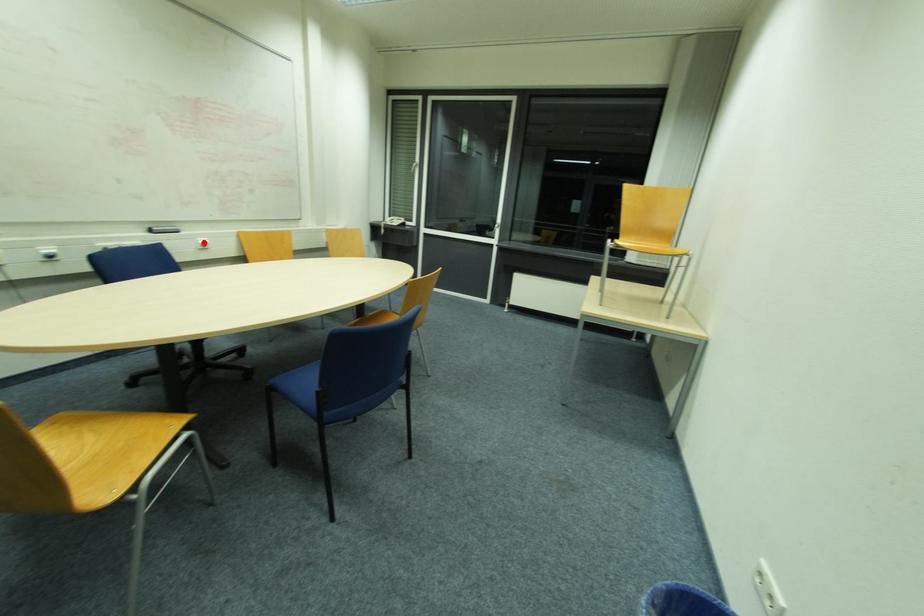
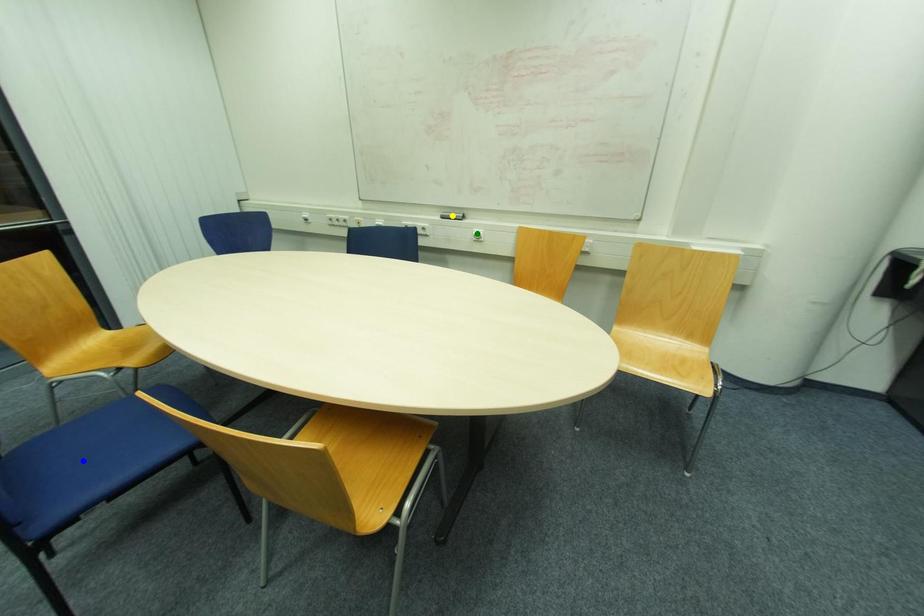
Question: I am providing you with two images of the same scene from different viewpoints. A red point is marked on the first image. You are given multiple points on the second image. Which point in image 2 is actually the same real-world point as the red point in image 1?

Choices:
 (A) green point
 (B) yellow point
 (C) blue point

Answer: (A)